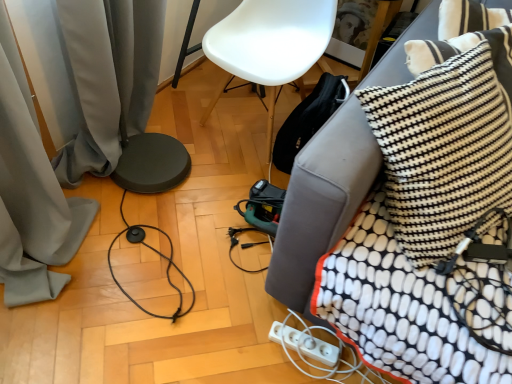
Question: Considering the relative positions of white plastic extension cord at lower right and white plastic power strip at lower right in the image provided, is white plastic extension cord at lower right behind white plastic power strip at lower right?

Choices:
 (A) yes
 (B) no

Answer: (B)

Question: Does white plastic extension cord at lower right have a smaller size compared to white plastic power strip at lower right?

Choices:
 (A) no
 (B) yes

Answer: (A)

Question: Considering the relative sizes of white plastic extension cord at lower right and white plastic power strip at lower right in the image provided, is white plastic extension cord at lower right taller than white plastic power strip at lower right?

Choices:
 (A) yes
 (B) no

Answer: (A)

Question: Can you confirm if white plastic extension cord at lower right is positioned to the right of white plastic power strip at lower right?

Choices:
 (A) yes
 (B) no

Answer: (A)

Question: Considering the relative sizes of white plastic extension cord at lower right and white plastic power strip at lower right in the image provided, is white plastic extension cord at lower right shorter than white plastic power strip at lower right?

Choices:
 (A) yes
 (B) no

Answer: (B)

Question: Which is correct: black fabric couch at lower right is inside white plastic power strip at lower right, or outside of it?

Choices:
 (A) inside
 (B) outside

Answer: (B)

Question: Considering the positions of black fabric couch at lower right and white plastic power strip at lower right in the image, is black fabric couch at lower right taller or shorter than white plastic power strip at lower right?

Choices:
 (A) short
 (B) tall

Answer: (B)

Question: From a real-world perspective, is black fabric couch at lower right physically located above or below white plastic power strip at lower right?

Choices:
 (A) above
 (B) below

Answer: (A)

Question: Looking at their shapes, would you say black fabric couch at lower right is wider or thinner than white plastic power strip at lower right?

Choices:
 (A) wide
 (B) thin

Answer: (A)

Question: In terms of size, does white plastic chair at center appear bigger or smaller than white textured blanket at right?

Choices:
 (A) big
 (B) small

Answer: (A)

Question: From the image's perspective, is white plastic chair at center above or below white textured blanket at right?

Choices:
 (A) below
 (B) above

Answer: (B)

Question: Would you say white plastic chair at center is inside or outside white textured blanket at right?

Choices:
 (A) outside
 (B) inside

Answer: (A)

Question: Based on their positions, is white plastic chair at center located to the left or right of white textured blanket at right?

Choices:
 (A) right
 (B) left

Answer: (B)

Question: Is point (362, 294) positioned closer to the camera than point (287, 259)?

Choices:
 (A) closer
 (B) farther

Answer: (A)

Question: In terms of height, does white textured blanket at right look taller or shorter compared to black fabric couch at lower right?

Choices:
 (A) short
 (B) tall

Answer: (A)